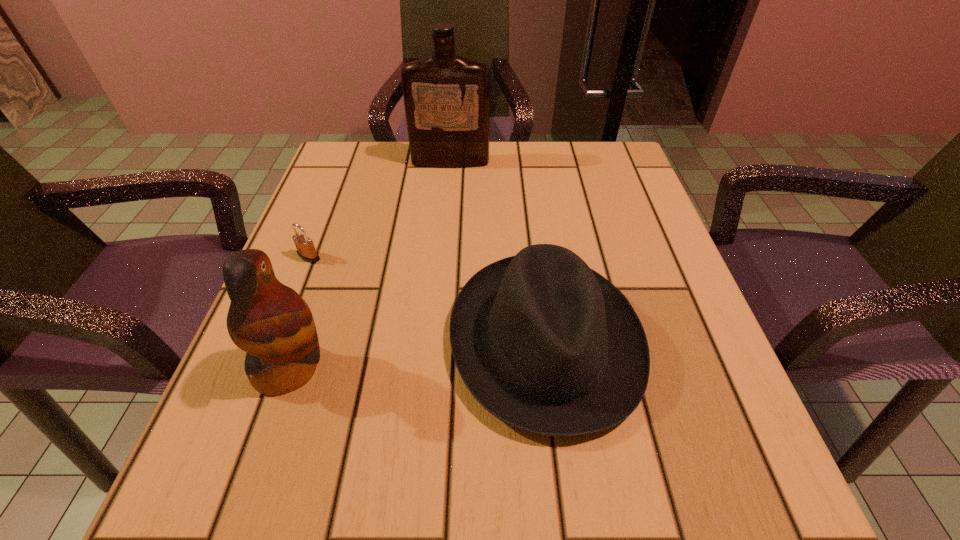
Locate an element on the screen. the tallest object is located at coordinates (446, 97).

Find the location of a particular element. This screenshot has width=960, height=540. liquor is located at coordinates (446, 97).

Where is `the third shortest object`? the third shortest object is located at coordinates (270, 321).

You are a GUI agent. You are given a task and a screenshot of the screen. Output one action in this format:
    pyautogui.click(x=<x>, y=<y>)
    Task: Click on the third tallest object
    This screenshot has height=540, width=960.
    Given the screenshot: What is the action you would take?
    pyautogui.click(x=544, y=343)

Locate an element on the screen. This screenshot has width=960, height=540. the third nearest object is located at coordinates (306, 250).

In order to click on the shortest object in this screenshot , I will do `click(306, 250)`.

Locate an element on the screen. free spot located on the label side of the farthest object is located at coordinates (445, 215).

You are a GUI agent. You are given a task and a screenshot of the screen. Output one action in this format:
    pyautogui.click(x=<x>, y=<y>)
    Task: Click on the free space located on the face of the parrot
    The image size is (960, 540).
    Given the screenshot: What is the action you would take?
    pyautogui.click(x=498, y=368)

Where is `blank area located 0.300m on the back of the fedora`? This screenshot has height=540, width=960. blank area located 0.300m on the back of the fedora is located at coordinates (525, 177).

Find the location of a particular element. free space located 0.290m on the back of the second farthest object is located at coordinates (344, 168).